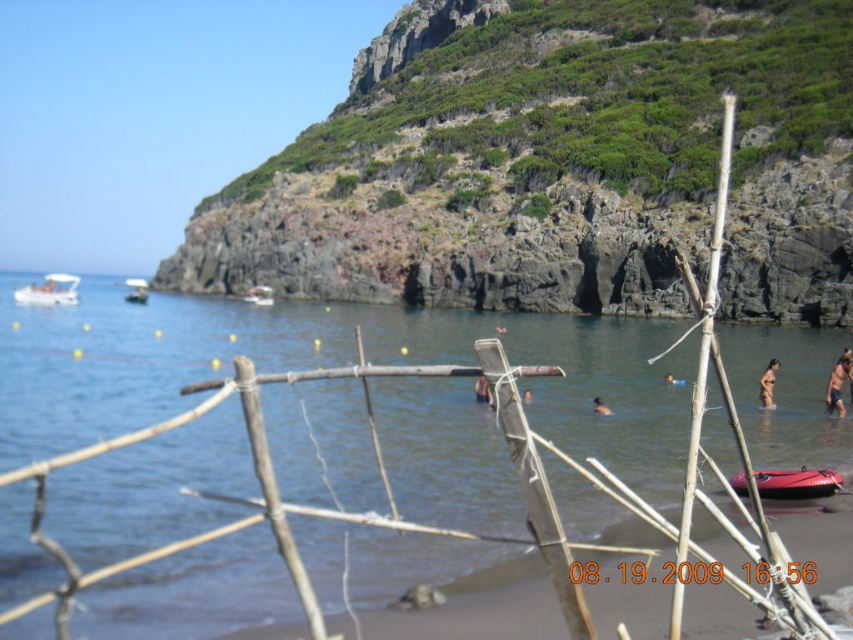
Question: Estimate the real-world distances between objects in this image. Which object is closer to the green rocky hillside at upper center?

Choices:
 (A) brown skin at center
 (B) clear water at center

Answer: (B)

Question: Is white plastic boat at upper left below blue skin at center?

Choices:
 (A) yes
 (B) no

Answer: (B)

Question: Is blue skin at center wider than brown skin at center?

Choices:
 (A) no
 (B) yes

Answer: (B)

Question: Can you confirm if white plastic boat at center is positioned to the right of smooth skin person at center?

Choices:
 (A) no
 (B) yes

Answer: (A)

Question: Which object is farther from the camera taking this photo?

Choices:
 (A) brown skin at lower right
 (B) blue skin at center

Answer: (A)

Question: Among these objects, which one is farthest from the camera?

Choices:
 (A) blue skin at center
 (B) white plastic boat at center
 (C) red rubber canoe at lower right
 (D) brown skin at lower right

Answer: (B)